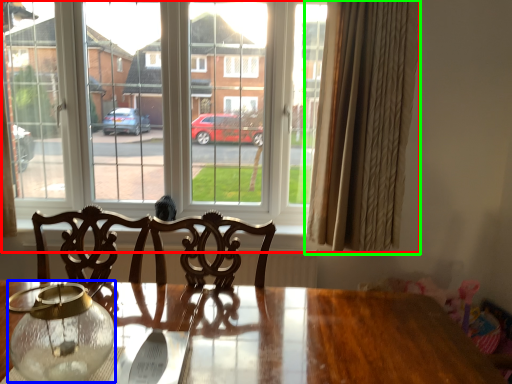
Question: Which object is positioned farthest from window (highlighted by a red box)? Select from glass vase (highlighted by a blue box) and curtain (highlighted by a green box).

Choices:
 (A) glass vase
 (B) curtain

Answer: (A)